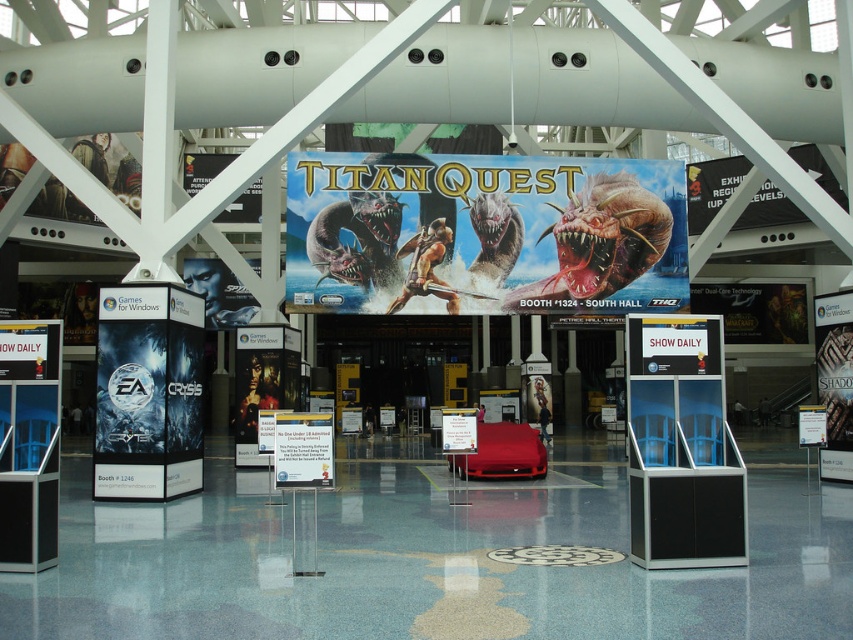
Between metallic blue banner at center and white paper sign at center, which one has less height?

Standing shorter between the two is white paper sign at center.

You are a GUI agent. You are given a task and a screenshot of the screen. Output one action in this format:
    pyautogui.click(x=<x>, y=<y>)
    Task: Click on the metallic blue banner at center
    This screenshot has width=853, height=640.
    Given the screenshot: What is the action you would take?
    pyautogui.click(x=485, y=234)

Describe the element at coordinates (485, 234) in the screenshot. I see `metallic blue banner at center` at that location.

Consider the image. Is metallic blue banner at center taller than metallic silver sign at right?

Yes, metallic blue banner at center is taller than metallic silver sign at right.

What do you see at coordinates (485, 234) in the screenshot?
I see `metallic blue banner at center` at bounding box center [485, 234].

Where is `metallic blue banner at center`? metallic blue banner at center is located at coordinates (485, 234).

Is metallic silver sign at right smaller than white paper sign at center?

No, metallic silver sign at right is not smaller than white paper sign at center.

Does metallic silver sign at right come in front of white paper sign at center?

No, metallic silver sign at right is behind white paper sign at center.

Identify the location of metallic silver sign at right. The height and width of the screenshot is (640, 853). (753, 310).